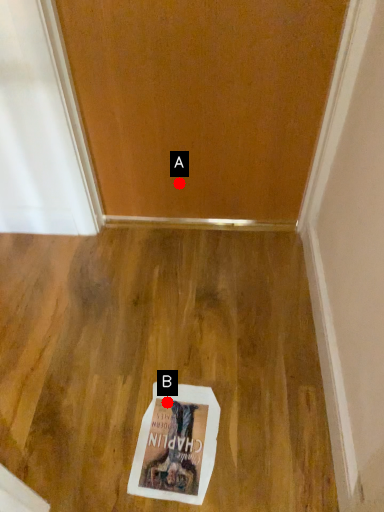
Question: Two points are circled on the image, labeled by A and B beside each circle. Which of the following is the farthest from the observer?

Choices:
 (A) A is further
 (B) B is further

Answer: (A)